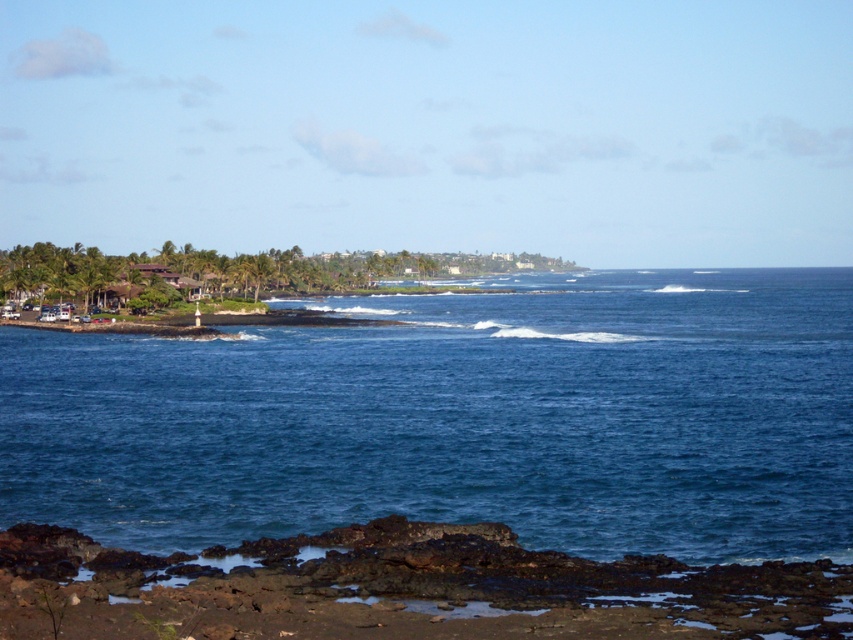
Measure the distance between blue water at center and rusty rock at lower left.

blue water at center and rusty rock at lower left are 38.50 meters apart from each other.

Who is more forward, [444,449] or [495,525]?

Positioned in front is point [495,525].

In order to click on blue water at center in this screenshot , I will do `click(461, 419)`.

Image resolution: width=853 pixels, height=640 pixels. Identify the location of blue water at center. (461, 419).